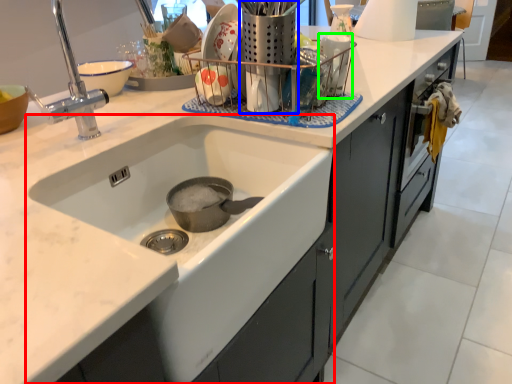
Question: Based on their relative distances, which object is farther from sink (highlighted by a red box)? Choose from appliance (highlighted by a blue box) and appliance (highlighted by a green box).

Choices:
 (A) appliance
 (B) appliance

Answer: (B)